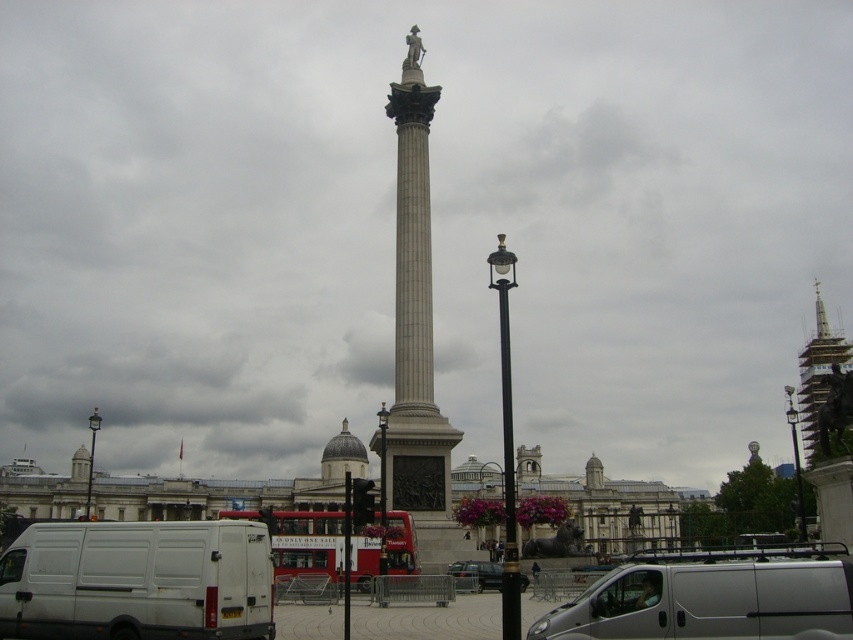
Question: Does black metal lamp post at center appear over metallic silver car at lower center?

Choices:
 (A) yes
 (B) no

Answer: (B)

Question: Is black metal lamp post at center in front of metallic silver car at lower center?

Choices:
 (A) yes
 (B) no

Answer: (A)

Question: Considering the real-world distances, which object is closest to the black metal lamp post at center?

Choices:
 (A) silver metallic van at center
 (B) gray stone column at center
 (C) gold textured spire at upper right
 (D) white matte van at lower left

Answer: (A)

Question: Which point is closer to the camera?

Choices:
 (A) (469, 573)
 (B) (62, 593)

Answer: (B)

Question: Does black polished lamp post at center appear on the left side of black metal streetlight at center?

Choices:
 (A) no
 (B) yes

Answer: (B)

Question: Based on their relative distances, which object is farther from the metallic silver car at lower center?

Choices:
 (A) white matte van at lower left
 (B) gold textured spire at upper right
 (C) white matte van at center
 (D) black metal streetlight at left

Answer: (B)